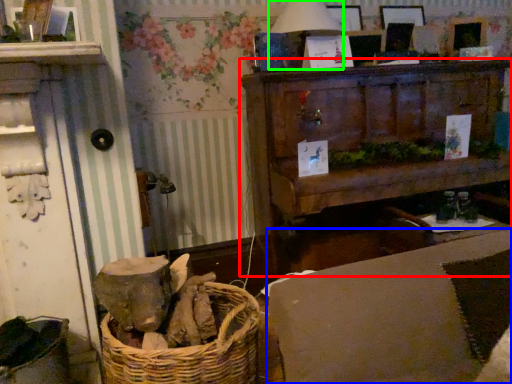
Question: Based on their relative distances, which object is nearer to furniture (highlighted by a red box)? Choose from couch (highlighted by a blue box) and table lamp (highlighted by a green box).

Choices:
 (A) couch
 (B) table lamp

Answer: (B)